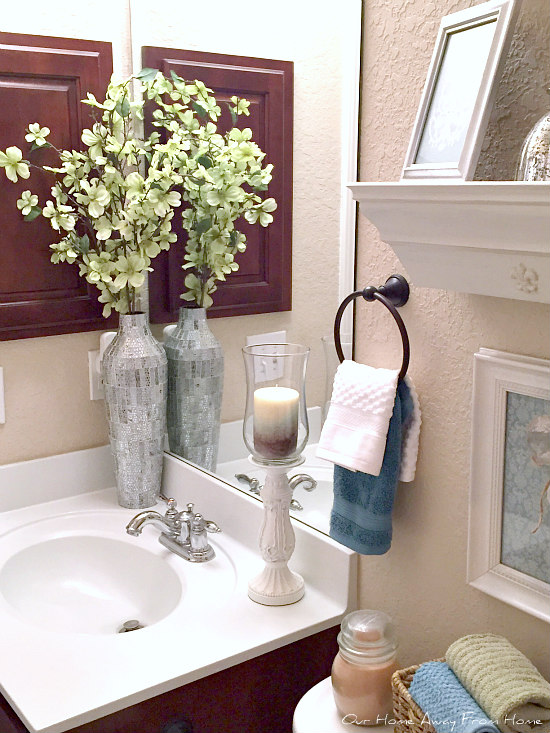
This screenshot has height=733, width=550. In order to click on picture in this screenshot , I will do `click(525, 476)`, `click(455, 95)`.